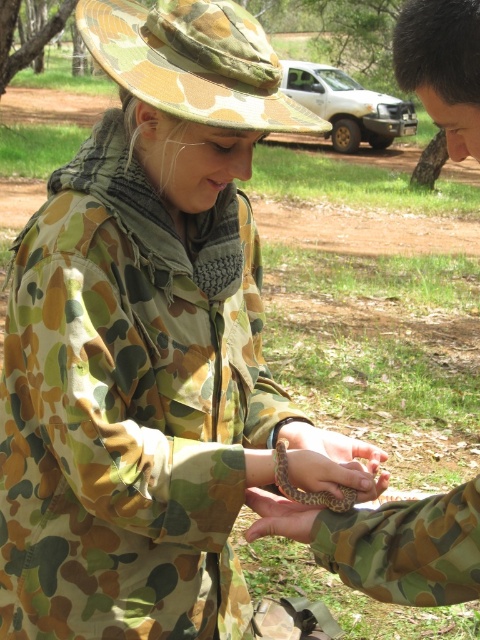
You are a researcher analyzing the spatial positioning of objects in the image. The camouflage fabric arm at center is located at which coordinate point?

The camouflage fabric arm at center is located at coordinate point (387, 544).